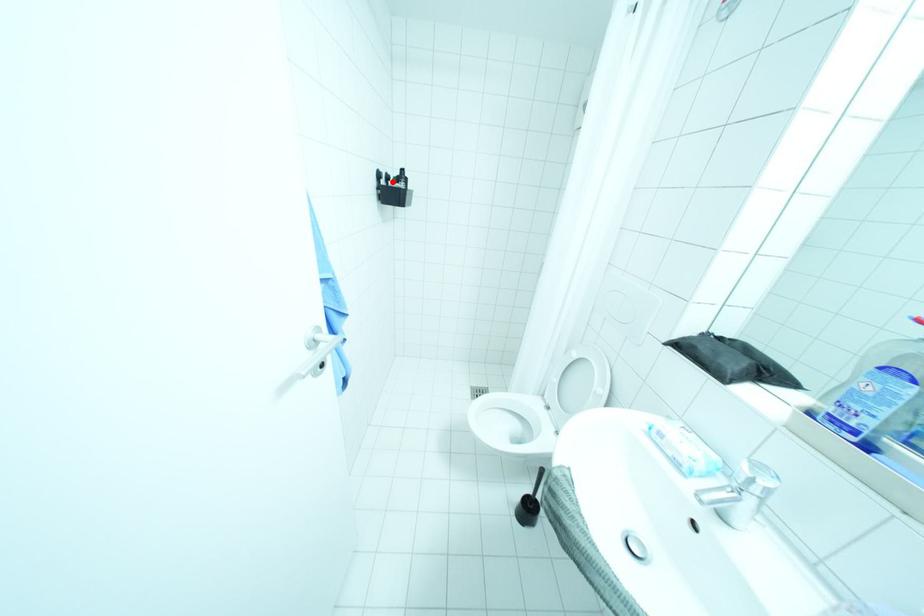
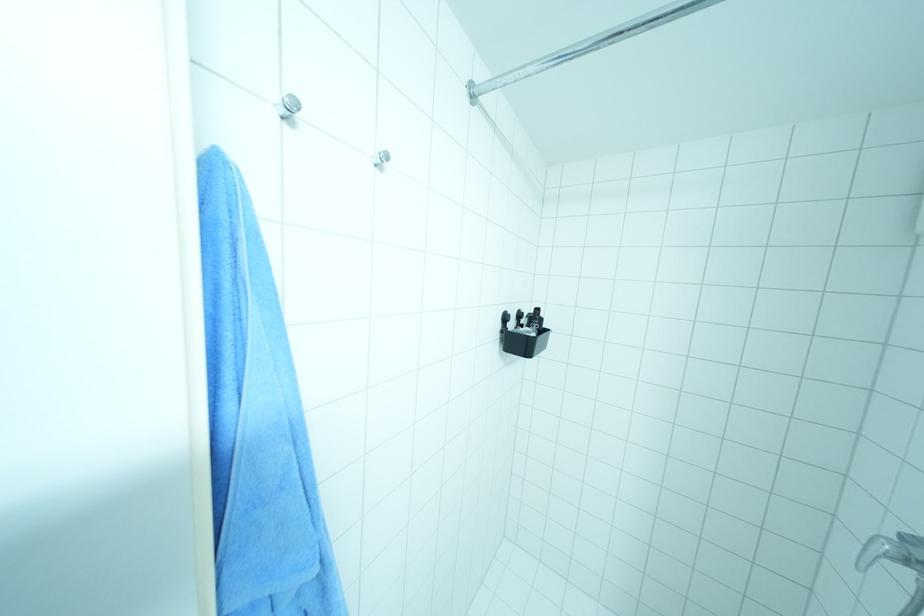
Find the pixel in the second image that matches the highlighted location in the first image.

(520, 323)